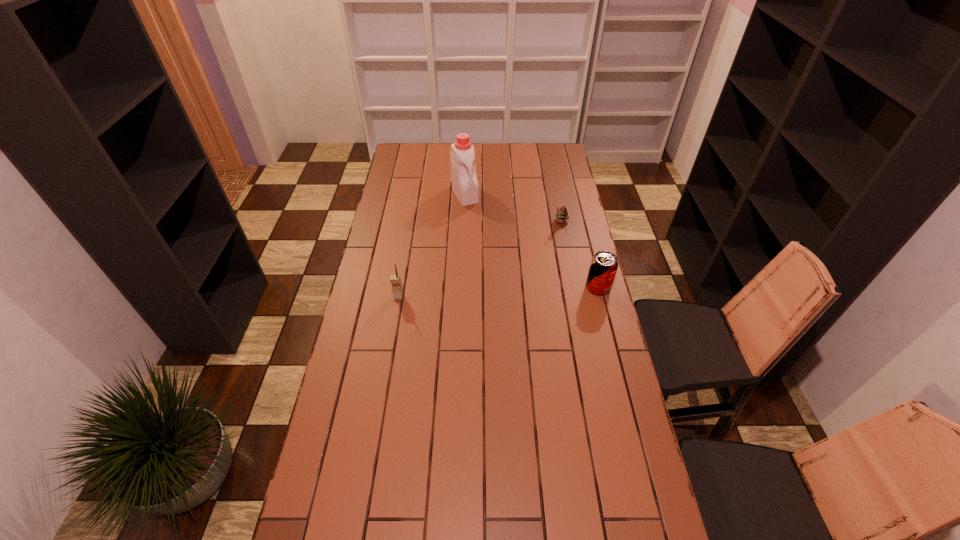
Where is `vacant space at the left edge of the desktop`? The image size is (960, 540). vacant space at the left edge of the desktop is located at coordinates (398, 259).

I want to click on free space at the right edge of the desktop, so click(x=545, y=210).

You are a GUI agent. You are given a task and a screenshot of the screen. Output one action in this format:
    pyautogui.click(x=<x>, y=<y>)
    Task: Click on the vacant region at the far left corner
    The width and height of the screenshot is (960, 540).
    Given the screenshot: What is the action you would take?
    pyautogui.click(x=398, y=148)

This screenshot has height=540, width=960. I want to click on unoccupied position between the detergent and the soda can, so click(x=532, y=240).

This screenshot has width=960, height=540. I want to click on free point between the third object from left to right and the detergent, so click(514, 208).

Where is `vacant area between the tallest object and the third object from left to right`? The image size is (960, 540). vacant area between the tallest object and the third object from left to right is located at coordinates (514, 208).

At what (x,y) coordinates should I click in order to perform the action: click on vacant space that is in between the third nearest object and the detergent. Please return your answer as a coordinate pair (x, y). Looking at the image, I should click on (514, 208).

Image resolution: width=960 pixels, height=540 pixels. What are the coordinates of `vacant region between the leftmost object and the farthest object` in the screenshot? It's located at (432, 245).

At what (x,y) coordinates should I click in order to perform the action: click on unoccupied position between the second object from right to left and the rightmost object. Please return your answer as a coordinate pair (x, y). This screenshot has height=540, width=960. Looking at the image, I should click on (580, 255).

Image resolution: width=960 pixels, height=540 pixels. I want to click on free space between the second object from right to left and the rightmost object, so click(x=580, y=255).